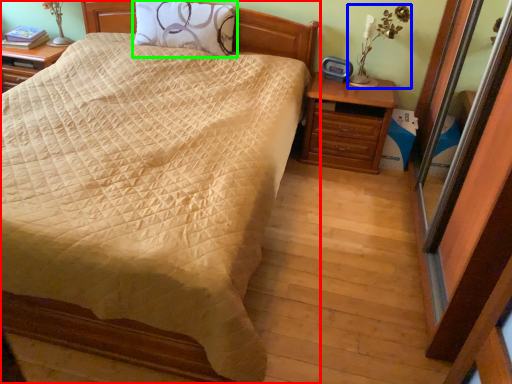
Question: Which object is positioned farthest from bed (highlighted by a red box)? Select from table lamp (highlighted by a blue box) and pillow (highlighted by a green box).

Choices:
 (A) table lamp
 (B) pillow

Answer: (A)